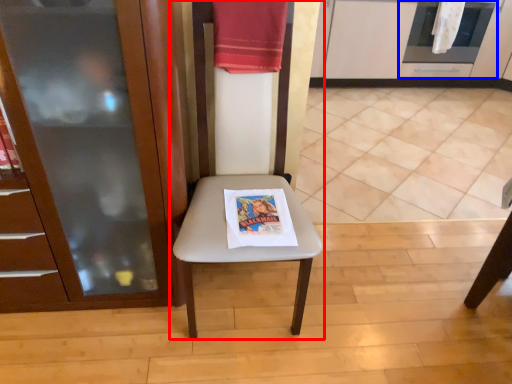
Question: Which of the following is the farthest to the observer, chair (highlighted by a red box) or oven (highlighted by a blue box)?

Choices:
 (A) chair
 (B) oven

Answer: (B)